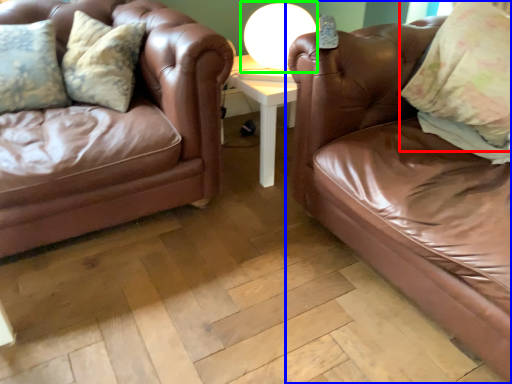
Question: Which is nearer to the pillow (highlighted by a red box)? studio couch (highlighted by a blue box) or table lamp (highlighted by a green box).

Choices:
 (A) studio couch
 (B) table lamp

Answer: (A)